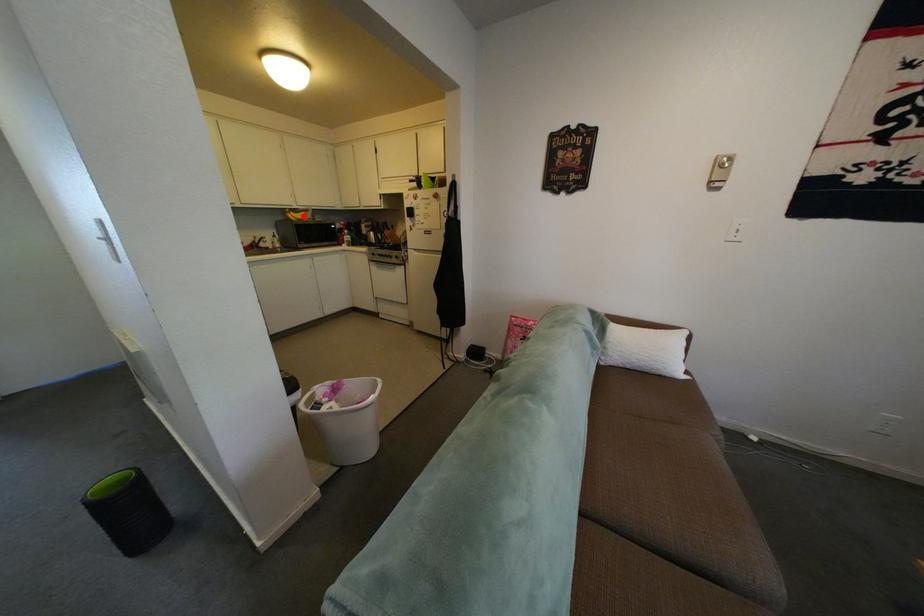
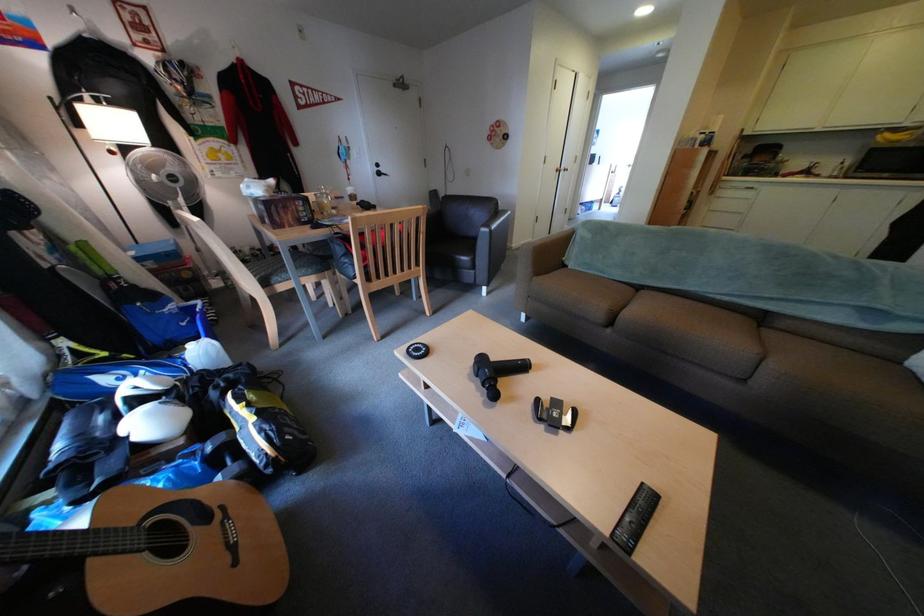
Find the pixel in the second image that matches the highlighted location in the first image.

(894, 138)